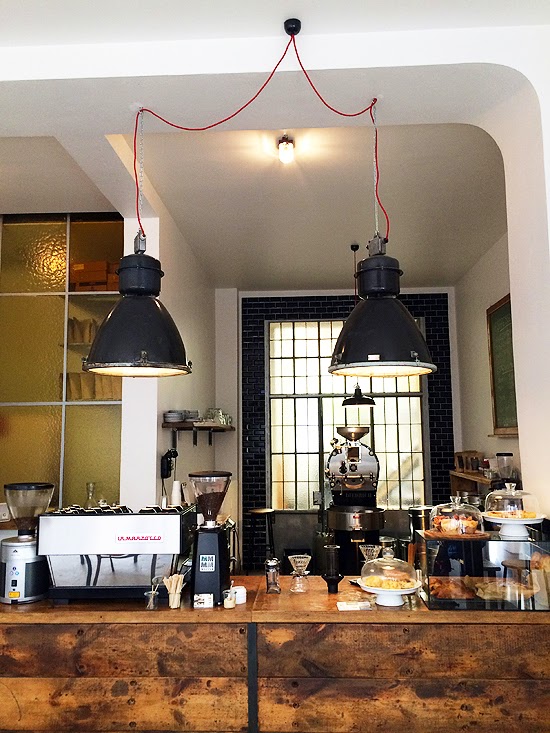
I want to click on container of pastries, so click(x=475, y=589).